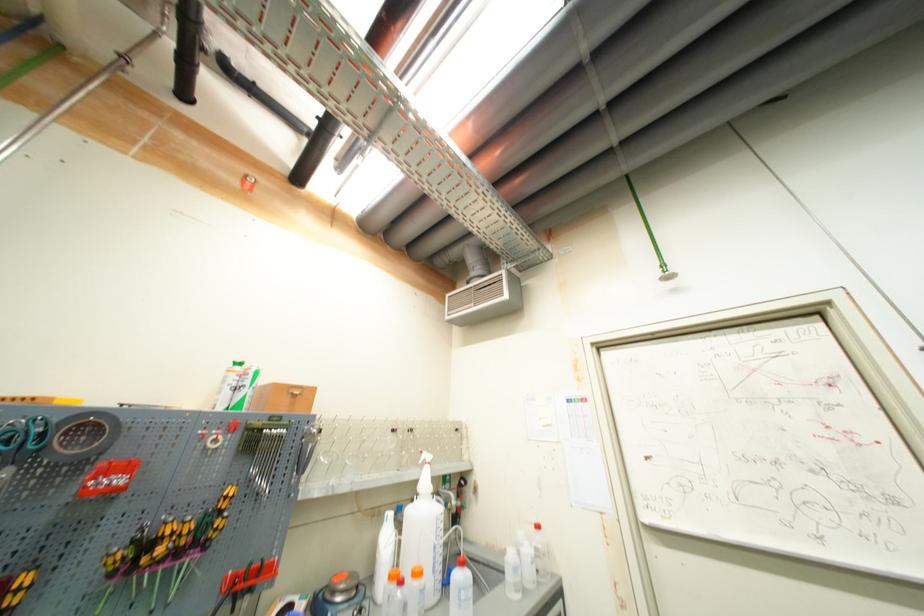
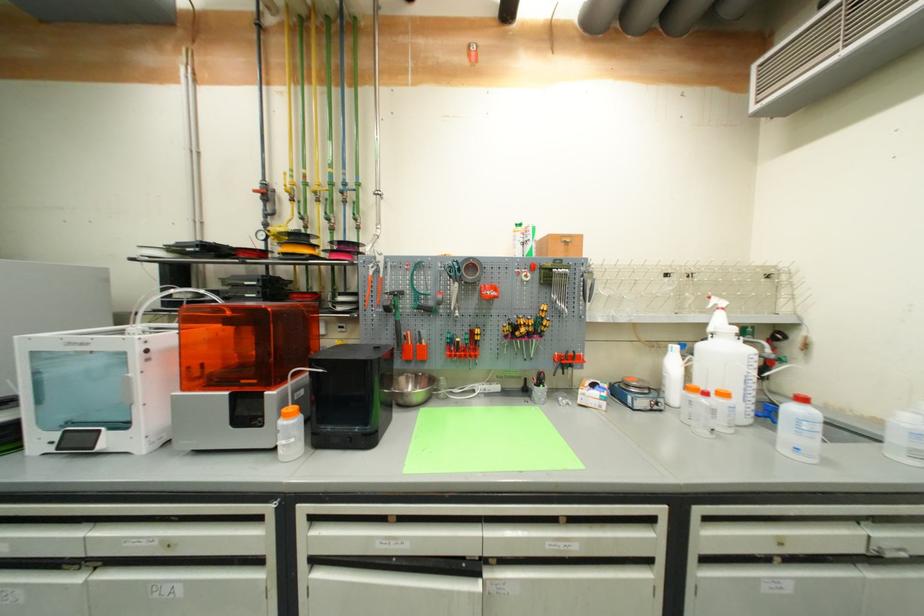
First-person continuous shooting, in which direction is the camera rotating?

The rotation direction of the camera is left-down.